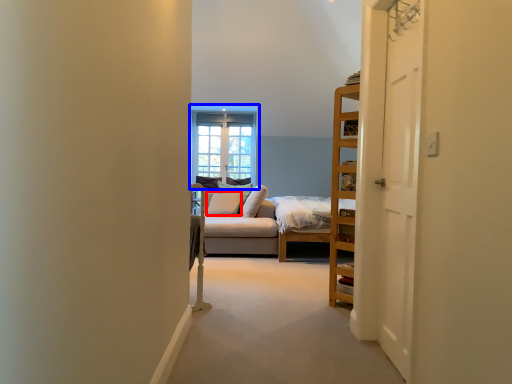
Question: Which object appears farthest to the camera in this image, pillow (highlighted by a red box) or window (highlighted by a blue box)?

Choices:
 (A) pillow
 (B) window

Answer: (B)